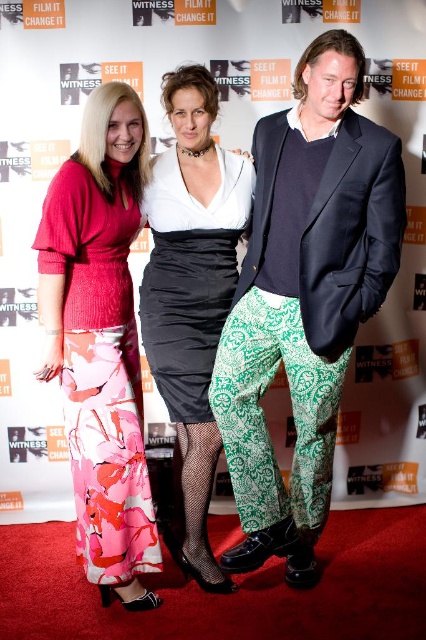
Consider the image. Who is more distant from viewer, (307,83) or (221,168)?

Point (221,168)

This screenshot has width=426, height=640. What do you see at coordinates (305, 298) in the screenshot?
I see `green printed pants at center` at bounding box center [305, 298].

The height and width of the screenshot is (640, 426). In order to click on green printed pants at center in this screenshot , I will do `click(305, 298)`.

Does floral fabric dress at left appear on the left side of satin dress at center?

Correct, you'll find floral fabric dress at left to the left of satin dress at center.

Is floral fabric dress at left further to camera compared to satin dress at center?

No, floral fabric dress at left is in front of satin dress at center.

Which is in front, point (129, 474) or point (175, 282)?

Point (129, 474) is more forward.

In order to click on floral fabric dress at left in this screenshot , I will do `click(100, 340)`.

Who is shorter, green printed pants at center or floral fabric dress at left?

floral fabric dress at left is shorter.

Which is below, green printed pants at center or floral fabric dress at left?

floral fabric dress at left is below.

The height and width of the screenshot is (640, 426). Identify the location of green printed pants at center. (305, 298).

Find the location of a particular element. Image resolution: width=426 pixels, height=640 pixels. green printed pants at center is located at coordinates (305, 298).